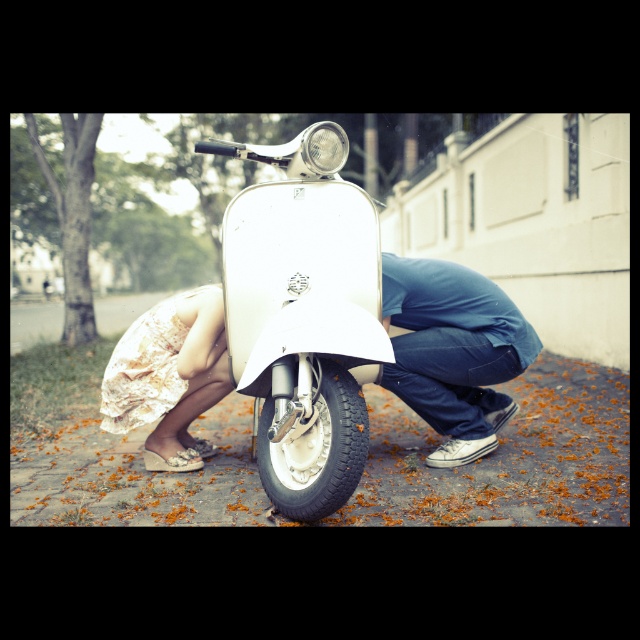
You are standing at the point with coordinates point (198, 323) and want to walk to the point with coordinates point (266, 433). Which direction should you move?

You should move forward because point (266, 433) is in front of point (198, 323).

You are designing a narrow pathway that must fit the white glossy scooter at center and the blue denim jeans at lower center. Which object will require more width in the pathway?

The blue denim jeans at lower center will require more width in the pathway because the white glossy scooter at center is thinner than blue denim jeans at lower center.

You are planning to take a photo of the white glossy scooter at center and the white floral dress at lower left. Since you want both objects to appear similarly sized in the photo, which object should you move closer to the camera?

Since the white glossy scooter at center is wider than the white floral dress at lower left, you should move the white glossy scooter at center closer to the camera to make it appear the same size as the white floral dress at lower left in the photo.